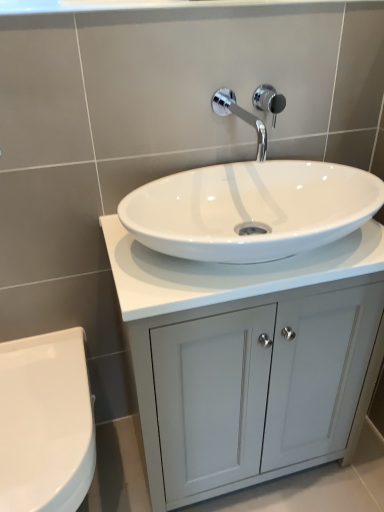
Question: Is chrome metallic faucet at upper center oriented away from white glossy countertop at center?

Choices:
 (A) no
 (B) yes

Answer: (A)

Question: Could you tell me if chrome metallic faucet at upper center is facing white glossy countertop at center?

Choices:
 (A) no
 (B) yes

Answer: (A)

Question: Is chrome metallic faucet at upper center taller than white glossy countertop at center?

Choices:
 (A) yes
 (B) no

Answer: (B)

Question: Does chrome metallic faucet at upper center have a smaller size compared to white glossy countertop at center?

Choices:
 (A) no
 (B) yes

Answer: (B)

Question: Considering the relative positions of chrome metallic faucet at upper center and white glossy countertop at center in the image provided, is chrome metallic faucet at upper center behind white glossy countertop at center?

Choices:
 (A) yes
 (B) no

Answer: (A)

Question: Which is correct: chrome metallic faucet at upper center is inside white glossy countertop at center, or outside of it?

Choices:
 (A) inside
 (B) outside

Answer: (B)

Question: Does point (215, 109) appear closer or farther from the camera than point (203, 274)?

Choices:
 (A) closer
 (B) farther

Answer: (B)

Question: Looking at their shapes, would you say chrome metallic faucet at upper center is wider or thinner than white glossy countertop at center?

Choices:
 (A) wide
 (B) thin

Answer: (B)

Question: From a real-world perspective, relative to white glossy countertop at center, is chrome metallic faucet at upper center vertically above or below?

Choices:
 (A) above
 (B) below

Answer: (A)

Question: From the image's perspective, is white glossy cabinet at center positioned above or below chrome metallic faucet at upper center?

Choices:
 (A) below
 (B) above

Answer: (A)

Question: Is white glossy cabinet at center in front of or behind chrome metallic faucet at upper center in the image?

Choices:
 (A) behind
 (B) front

Answer: (B)

Question: From their relative heights in the image, would you say white glossy cabinet at center is taller or shorter than chrome metallic faucet at upper center?

Choices:
 (A) short
 (B) tall

Answer: (B)

Question: From a real-world perspective, is white glossy cabinet at center positioned above or below chrome metallic faucet at upper center?

Choices:
 (A) below
 (B) above

Answer: (A)

Question: From the image's perspective, relative to white glossy countertop at center, is chrome metallic shower at upper center above or below?

Choices:
 (A) below
 (B) above

Answer: (B)

Question: Considering their positions, is chrome metallic shower at upper center located in front of or behind white glossy countertop at center?

Choices:
 (A) front
 (B) behind

Answer: (B)